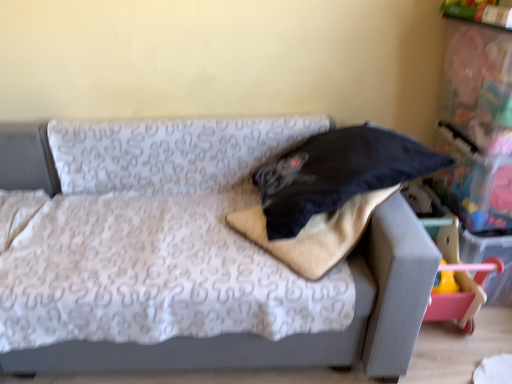
The image size is (512, 384). What do you see at coordinates (293, 335) in the screenshot?
I see `textured gray couch at center` at bounding box center [293, 335].

Find the location of a particular element. textured gray couch at center is located at coordinates (293, 335).

What is the approximate width of textured gray couch at center?

1.48 meters.

Image resolution: width=512 pixels, height=384 pixels. Describe the element at coordinates (338, 173) in the screenshot. I see `black fabric pillow at center` at that location.

Find the location of a particular element. The image size is (512, 384). black fabric pillow at center is located at coordinates (338, 173).

What is the approximate width of black fabric pillow at center?

It is 24.27 inches.

What is the approximate height of black fabric pillow at center?

12.94 inches.

Identify the location of textured gray couch at center. (293, 335).

Which is more to the right, textured gray couch at center or black fabric pillow at center?

From the viewer's perspective, black fabric pillow at center appears more on the right side.

Based on the photo, which object is closer to the camera taking this photo, textured gray couch at center or black fabric pillow at center?

Positioned in front is textured gray couch at center.

Is point (240, 345) closer to camera compared to point (345, 150)?

That is True.

From the image's perspective, relative to black fabric pillow at center, is textured gray couch at center above or below?

textured gray couch at center is situated lower than black fabric pillow at center in the image.

From a real-world perspective, between textured gray couch at center and black fabric pillow at center, who is vertically lower?

textured gray couch at center is physically lower.

Which of these two, textured gray couch at center or black fabric pillow at center, is wider?

textured gray couch at center.

Consider the image. Does textured gray couch at center have a lesser height compared to black fabric pillow at center?

No.

Which of these two, textured gray couch at center or black fabric pillow at center, is smaller?

black fabric pillow at center.

Is black fabric pillow at center surrounded by textured gray couch at center?

Yes, black fabric pillow at center is surrounded by textured gray couch at center.

Would you say textured gray couch at center is a long distance from black fabric pillow at center?

That's not correct — textured gray couch at center is a little close to black fabric pillow at center.

Is textured gray couch at center facing away from black fabric pillow at center?

No, textured gray couch at center is not facing the opposite direction of black fabric pillow at center.

How many degrees apart are the facing directions of textured gray couch at center and black fabric pillow at center?

They differ by 86 degrees in their facing directions.

How much distance is there between textured gray couch at center and black fabric pillow at center?

12.18 inches.

This screenshot has width=512, height=384. In order to click on pillow above the textured gray couch at center (from the image's perspective) in this screenshot , I will do pyautogui.click(x=338, y=173).

Which is more to the left, black fabric pillow at center or textured gray couch at center?

textured gray couch at center.

In the image, is black fabric pillow at center positioned in front of or behind textured gray couch at center?

Clearly, black fabric pillow at center is behind textured gray couch at center.

Is point (267, 171) farther from camera compared to point (42, 365)?

Yes, point (267, 171) is farther from viewer.

From the image's perspective, which one is positioned lower, black fabric pillow at center or textured gray couch at center?

From the image's view, textured gray couch at center is below.

From a real-world perspective, which object stands above the other?

In real-world perspective, black fabric pillow at center is above.

Looking at their sizes, would you say black fabric pillow at center is wider or thinner than textured gray couch at center?

In the image, black fabric pillow at center appears to be more narrow than textured gray couch at center.

Between black fabric pillow at center and textured gray couch at center, which one has less height?

Standing shorter between the two is black fabric pillow at center.

Looking at this image, can you confirm if black fabric pillow at center is smaller than textured gray couch at center?

Indeed, black fabric pillow at center has a smaller size compared to textured gray couch at center.

Is textured gray couch at center inside black fabric pillow at center?

No, textured gray couch at center is not a part of black fabric pillow at center.

Would you say black fabric pillow at center is a long distance from textured gray couch at center?

black fabric pillow at center is actually quite close to textured gray couch at center.

Is black fabric pillow at center oriented away from textured gray couch at center?

Correct, black fabric pillow at center is looking away from textured gray couch at center.

At what (x,y) coordinates should I click in order to perform the action: click on pillow on the right side of textured gray couch at center. Please return your answer as a coordinate pair (x, y). This screenshot has width=512, height=384. Looking at the image, I should click on (338, 173).

The image size is (512, 384). What are the coordinates of `pillow that appears behind the textured gray couch at center` in the screenshot? It's located at (338, 173).

Where is `studio couch that is under the black fabric pillow at center (from a real-world perspective)`? studio couch that is under the black fabric pillow at center (from a real-world perspective) is located at coordinates (293, 335).